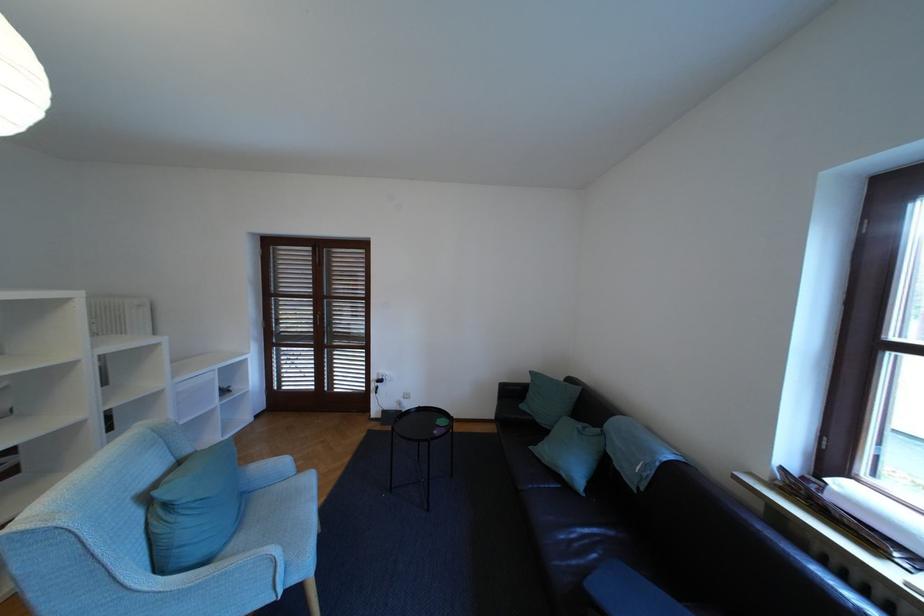
The width and height of the screenshot is (924, 616). I want to click on black sofa sitting surface, so click(566, 530).